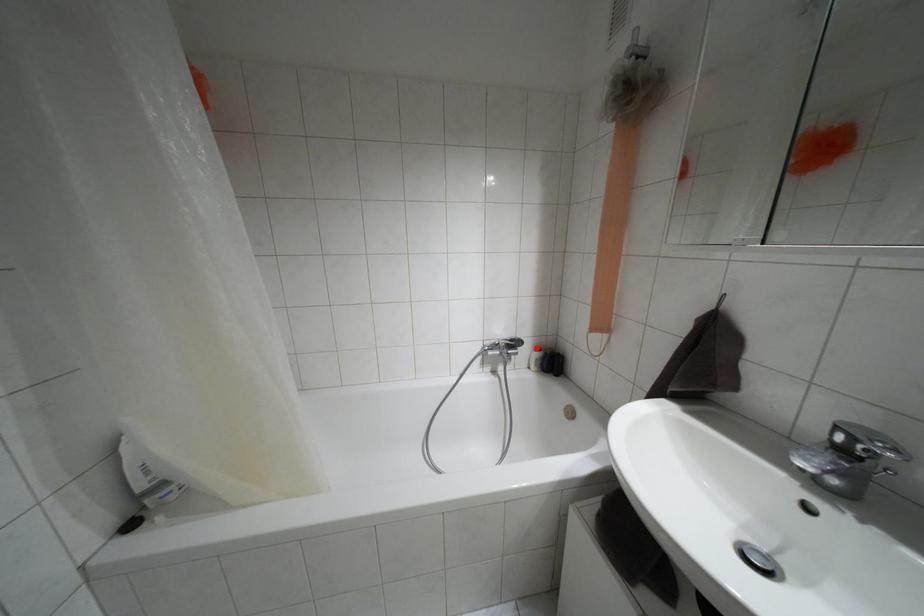
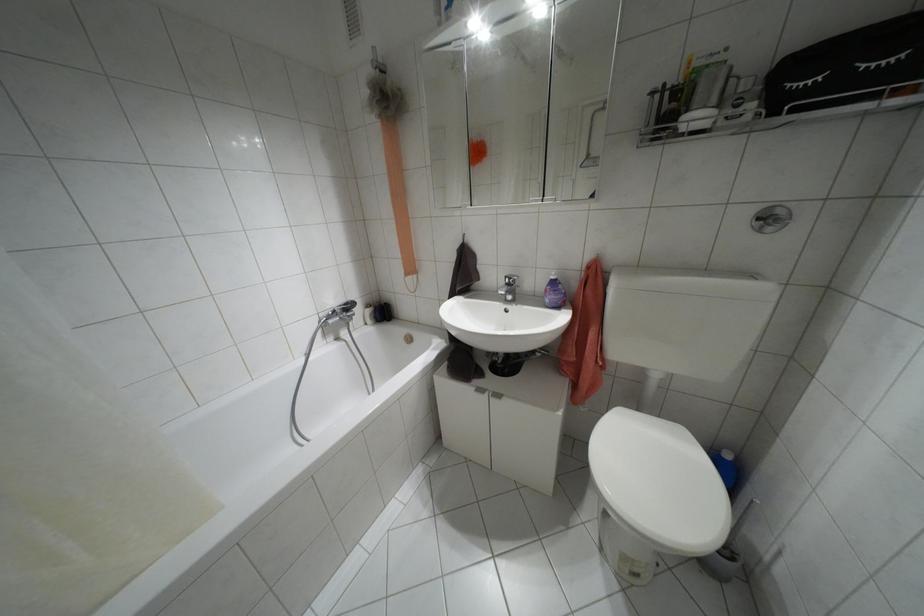
In the second image, find the point that corresponds to the highlighted location in the first image.

(367, 305)